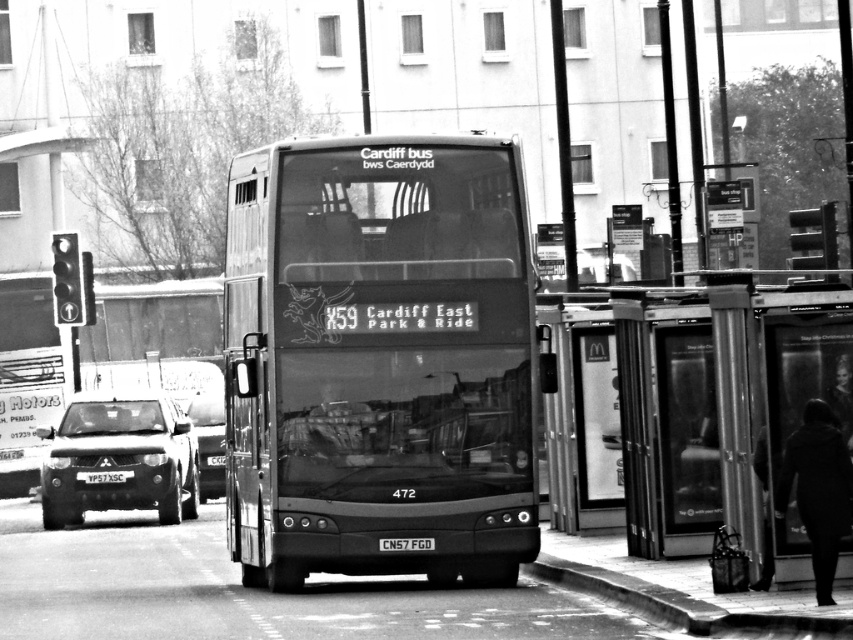
Based on the photo, you are a pedestrian standing at the smooth concrete curb at lower center. You want to reach the transparent glass bus stop at right to check the schedule. Which direction should you walk to get there?

You should walk to the right from the smooth concrete curb at lower center to reach the transparent glass bus stop at right since it is located to the right of it.

You are a pedestrian standing at the bus stop. You notice a metallic silver bus at center and a shiny black suv at left. Which vehicle is taller?

The metallic silver bus at center is much taller than the shiny black suv at left.